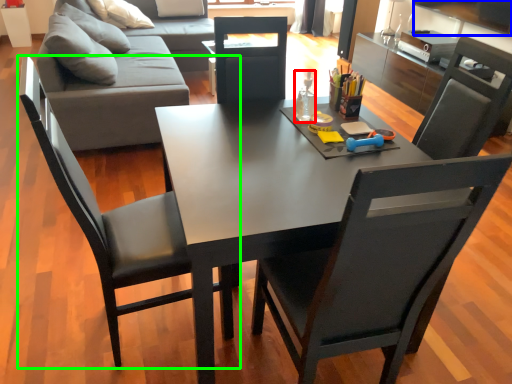
Question: Considering the real-world distances, which object is farthest from bottle (highlighted by a red box)? television (highlighted by a blue box) or chair (highlighted by a green box)?

Choices:
 (A) television
 (B) chair

Answer: (A)